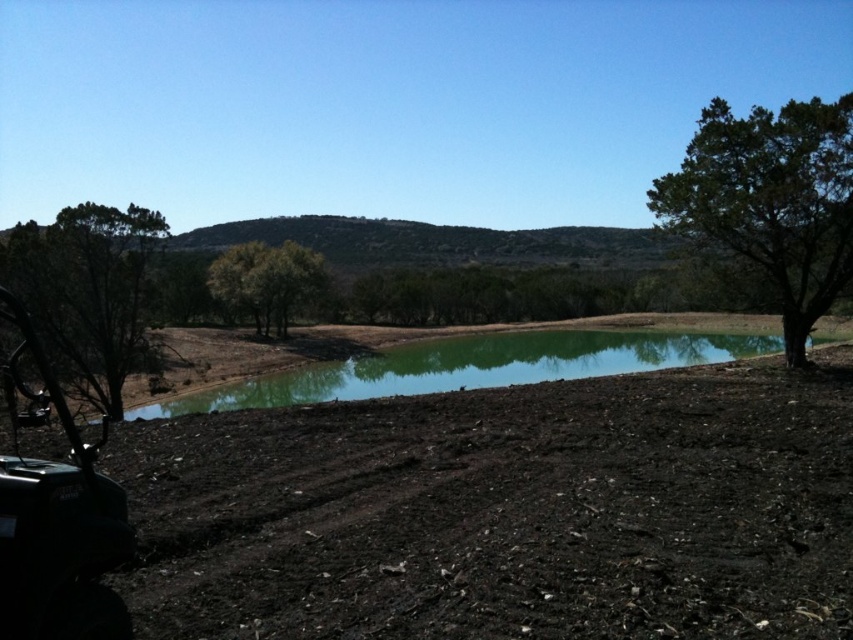
Question: Is green leafy tree at right wider than green leafy tree at left?

Choices:
 (A) no
 (B) yes

Answer: (A)

Question: Which of these objects is positioned closest to the green reflective water at center?

Choices:
 (A) green leafy tree at right
 (B) dark soil at center
 (C) green leafy tree at center
 (D) green leafy tree at left

Answer: (B)

Question: Which point appears closest to the camera in this image?

Choices:
 (A) (480, 378)
 (B) (61, 220)
 (C) (242, 284)
 (D) (850, 228)

Answer: (D)

Question: Can you confirm if dark soil at center is smaller than green leafy tree at left?

Choices:
 (A) yes
 (B) no

Answer: (B)

Question: Observing the image, what is the correct spatial positioning of dark soil at center in reference to green reflective water at center?

Choices:
 (A) below
 (B) above

Answer: (B)

Question: Among these points, which one is farthest from the camera?

Choices:
 (A) (836, 224)
 (B) (83, 458)
 (C) (30, 243)

Answer: (C)